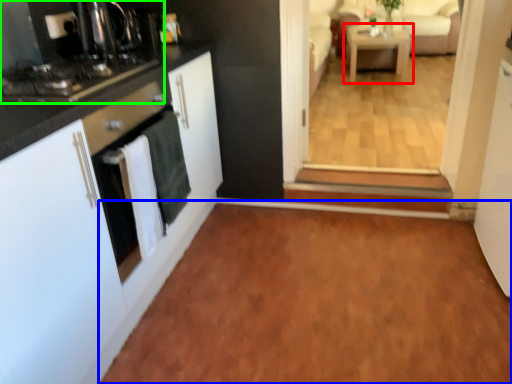
Question: Considering the real-world distances, which object is farthest from table (highlighted by a red box)? plain (highlighted by a blue box) or home appliance (highlighted by a green box)?

Choices:
 (A) plain
 (B) home appliance

Answer: (B)